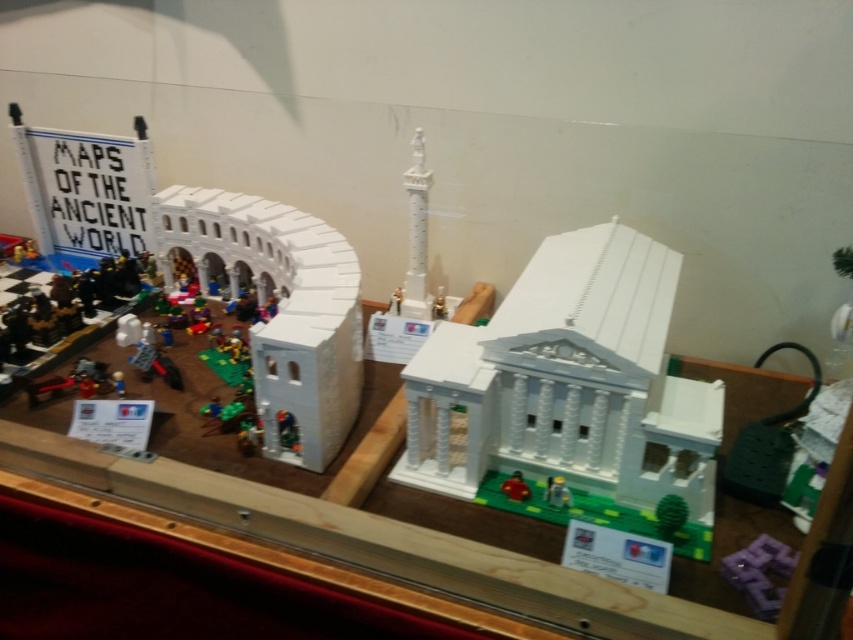
Question: Which object appears farthest from the camera in this image?

Choices:
 (A) purple plastic blocks at lower right
 (B) smooth red car at center
 (C) white glossy lego building at center

Answer: (B)

Question: Among these objects, which one is nearest to the camera?

Choices:
 (A) smooth red car at center
 (B) green plastic toy at center

Answer: (B)

Question: Which point is closer to the camera?

Choices:
 (A) (561, 497)
 (B) (741, 554)

Answer: (B)

Question: Can you confirm if white matte lego amphitheater at left is thinner than green plastic toy at center?

Choices:
 (A) yes
 (B) no

Answer: (B)

Question: Does white glossy lego building at center have a greater width compared to smooth red car at center?

Choices:
 (A) yes
 (B) no

Answer: (A)

Question: Can you confirm if white glossy lego building at center is positioned to the right of green plastic toy at center?

Choices:
 (A) yes
 (B) no

Answer: (A)